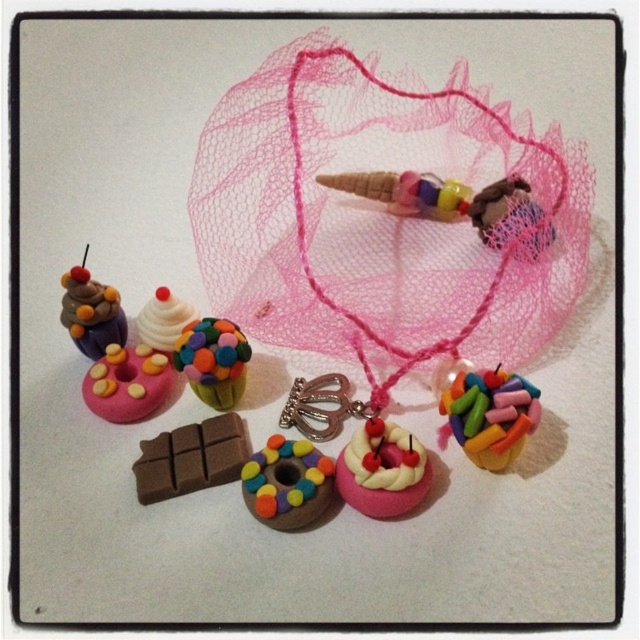
You are a collector of miniature food items and you see the point at coordinates (189, 458) in the image. Which miniature food item is located exactly at that point?

The point at coordinates (189, 458) corresponds to the brown matte chocolate bar at lower left.

You are arranging miniature food items on a plain off white surface. You have a brown matte chocolate bar at lower left and a pink netting or mesh bag necklace at center right. Which item is positioned closer to the bottom edge of the surface?

The brown matte chocolate bar at lower left is positioned closer to the bottom edge of the surface because its coordinates are at point (189, 458), which places it lower on the surface compared to the pink netting or mesh bag necklace at center right.

From the picture: You are a jeweler who needs to place the pink mesh net at center and the matte brown donut at center into a display case. The case has a shelf that can only hold items spaced at least 15 inches apart. Can you fit both items on the shelf without violating the spacing requirement?

The distance between the pink mesh net at center and matte brown donut at center is 14.94 inches, which is slightly less than the required 15 inches. Therefore, they cannot be placed on the shelf without violating the spacing requirement.